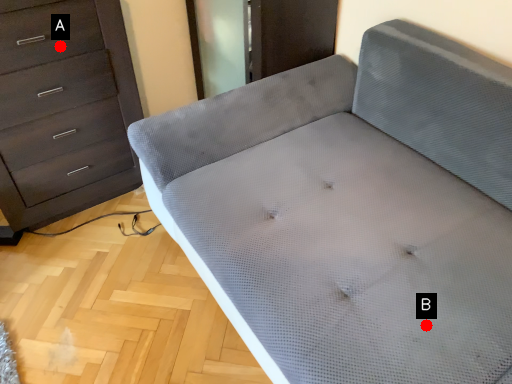
Question: Two points are circled on the image, labeled by A and B beside each circle. Which point is farther from the camera taking this photo?

Choices:
 (A) A is further
 (B) B is further

Answer: (A)